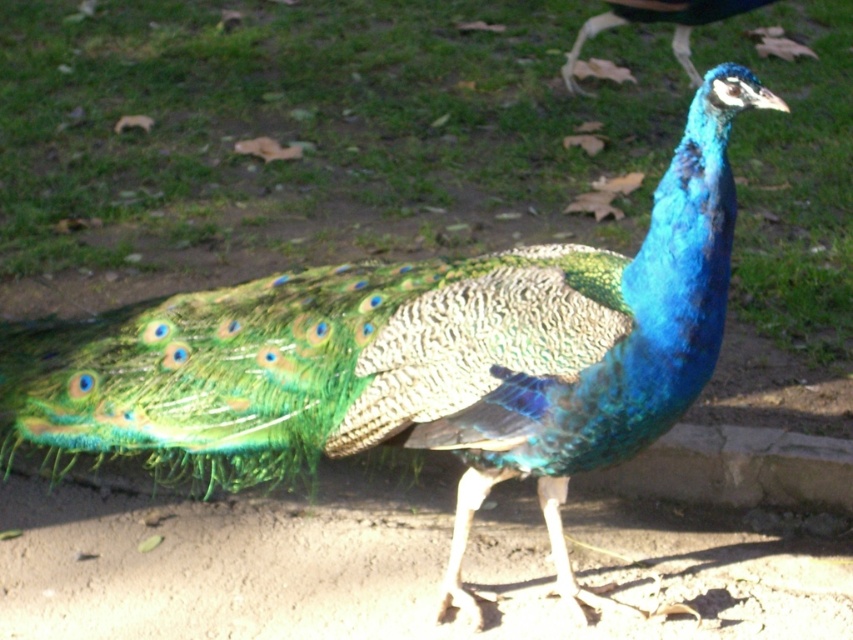
Question: Among these points, which one is nearest to the camera?

Choices:
 (A) (601, 20)
 (B) (467, 92)

Answer: (A)

Question: Which of the following is the farthest from the observer?

Choices:
 (A) green textured grass at center
 (B) blue iridescent feathers at upper center

Answer: (B)

Question: Does green textured grass at center have a smaller size compared to blue iridescent feathers at upper center?

Choices:
 (A) no
 (B) yes

Answer: (A)

Question: Is green textured grass at center positioned before blue iridescent feathers at upper center?

Choices:
 (A) yes
 (B) no

Answer: (A)

Question: Does green textured grass at center lie in front of blue iridescent feathers at upper center?

Choices:
 (A) yes
 (B) no

Answer: (A)